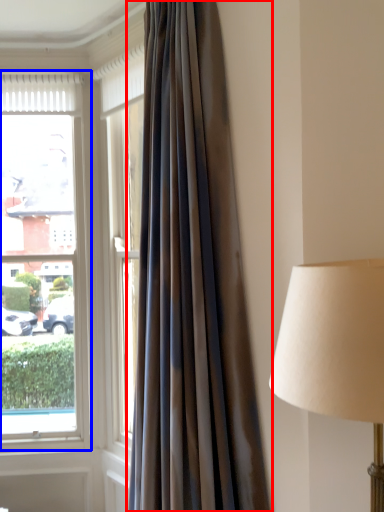
Question: Which object is closer to the camera taking this photo, curtain (highlighted by a red box) or window (highlighted by a blue box)?

Choices:
 (A) curtain
 (B) window

Answer: (A)